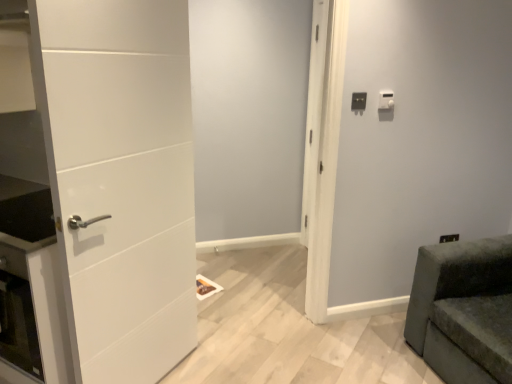
Find the location of `free point to the right of white matte door at center`. free point to the right of white matte door at center is located at coordinates (333, 344).